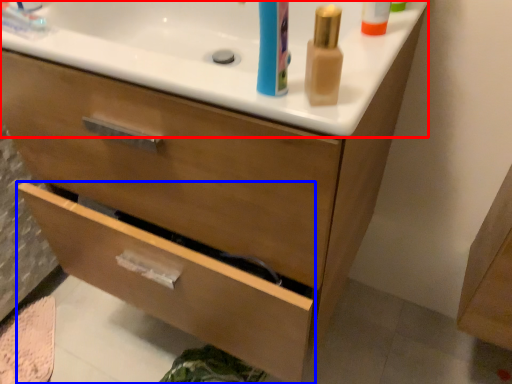
Question: Which point is closer to the camera, counter top (highlighted by a red box) or drawer (highlighted by a blue box)?

Choices:
 (A) counter top
 (B) drawer

Answer: (A)